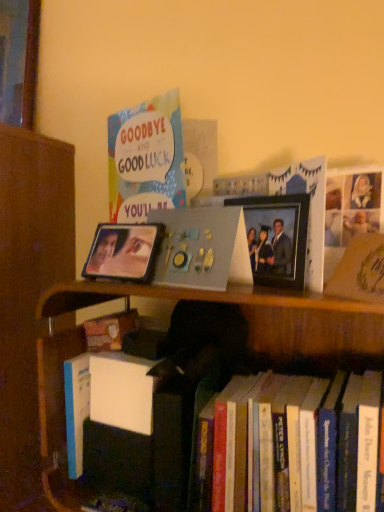
Question: Is metallic photo frame at center, the first picture frame positioned from the right, aimed at metallic reflective photo frame at center, the 2th picture frame viewed from the right?

Choices:
 (A) yes
 (B) no

Answer: (B)

Question: Is metallic photo frame at center, which is the second picture frame in left-to-right order, surrounding metallic reflective photo frame at center, the 1th picture frame positioned from the left?

Choices:
 (A) no
 (B) yes

Answer: (A)

Question: Can you confirm if metallic photo frame at center, the first picture frame positioned from the right, is smaller than metallic reflective photo frame at center, the 2th picture frame viewed from the right?

Choices:
 (A) yes
 (B) no

Answer: (A)

Question: From a real-world perspective, is metallic photo frame at center, which is the second picture frame in left-to-right order, physically above metallic reflective photo frame at center, the 2th picture frame viewed from the right?

Choices:
 (A) no
 (B) yes

Answer: (B)

Question: Does metallic photo frame at center, which is the second picture frame in left-to-right order, have a greater height compared to metallic reflective photo frame at center, the 2th picture frame viewed from the right?

Choices:
 (A) no
 (B) yes

Answer: (A)

Question: From a real-world perspective, is hardcover books at lower right positioned above or below metallic reflective photo frame at center, the 2th picture frame viewed from the right?

Choices:
 (A) above
 (B) below

Answer: (B)

Question: In the image, is hardcover books at lower right positioned in front of or behind metallic reflective photo frame at center, the 1th picture frame positioned from the left?

Choices:
 (A) behind
 (B) front

Answer: (B)

Question: From their relative heights in the image, would you say hardcover books at lower right is taller or shorter than metallic reflective photo frame at center, the 2th picture frame viewed from the right?

Choices:
 (A) short
 (B) tall

Answer: (B)

Question: In terms of size, does hardcover books at lower right appear bigger or smaller than metallic reflective photo frame at center, the 1th picture frame positioned from the left?

Choices:
 (A) small
 (B) big

Answer: (B)

Question: Looking at their shapes, would you say metallic photo frame at center, the first picture frame positioned from the right, is wider or thinner than hardcover books at lower right?

Choices:
 (A) thin
 (B) wide

Answer: (A)

Question: From a real-world perspective, is metallic photo frame at center, which is the second picture frame in left-to-right order, above or below hardcover books at lower right?

Choices:
 (A) below
 (B) above

Answer: (B)

Question: From the image's perspective, is metallic photo frame at center, the first picture frame positioned from the right, located above or below hardcover books at lower right?

Choices:
 (A) below
 (B) above

Answer: (B)

Question: Visually, is metallic photo frame at center, which is the second picture frame in left-to-right order, positioned to the left or to the right of hardcover books at lower right?

Choices:
 (A) left
 (B) right

Answer: (B)

Question: Based on their positions, is matte paper card at upper left located to the left or right of hardcover books at lower right?

Choices:
 (A) right
 (B) left

Answer: (B)

Question: In terms of size, does matte paper card at upper left appear bigger or smaller than hardcover books at lower right?

Choices:
 (A) small
 (B) big

Answer: (A)